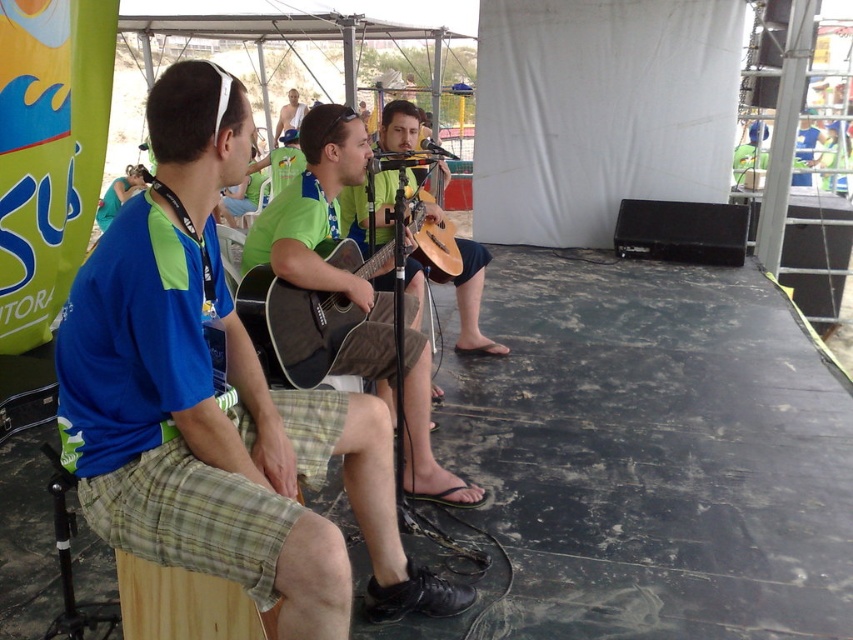
You are a photographer positioned behind the stage. You need to capture a shot that includes both the blue fabric shirt at left and the matte black acoustic guitar at center. Based on their positions, which object should appear lower in the photo?

The blue fabric shirt at left is located below the matte black acoustic guitar at center, so in the photo, the blue fabric shirt at left will appear lower than the matte black acoustic guitar at center.

You are a photographer setting up for a live music event. You need to ensure that all performers are visible in the photo. Given the blue fabric shirt at left and the matte black acoustic guitar at center, which object takes up more horizontal space in the image?

The blue fabric shirt at left takes up more horizontal space than the matte black acoustic guitar at center because its width is larger.

You are standing at the entrance of the tent and want to approach the musician wearing the blue fabric shirt at left. Based on their position, which direction should you move to reach them?

The blue fabric shirt at left is located at point 0.628 on the x axis and 0.254 on the y axis. Since you are at the entrance, you should move towards the left and forward to reach them.